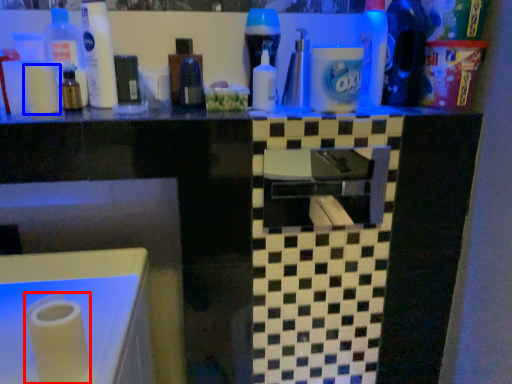
Question: Which point is further to the camera, paper towel (highlighted by a red box) or toilet paper (highlighted by a blue box)?

Choices:
 (A) paper towel
 (B) toilet paper

Answer: (B)